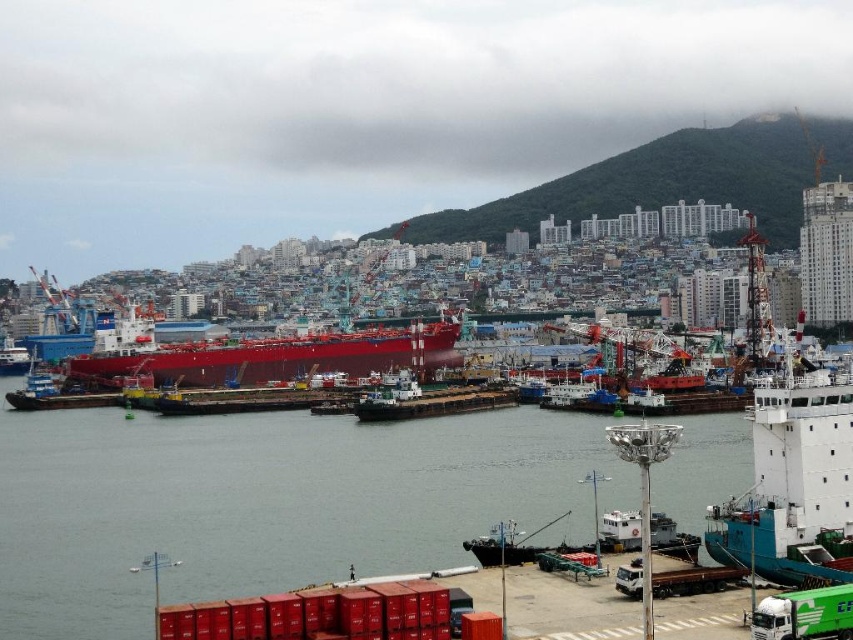
Question: Can you confirm if transparent water at center is thinner than white matte ship at right?

Choices:
 (A) yes
 (B) no

Answer: (B)

Question: Is transparent water at center above glossy red ship at center?

Choices:
 (A) yes
 (B) no

Answer: (B)

Question: Which object is farther from the camera taking this photo?

Choices:
 (A) glossy red ship at center
 (B) transparent water at center

Answer: (A)

Question: Estimate the real-world distances between objects in this image. Which object is closer to the glossy red ship at center?

Choices:
 (A) white matte ship at right
 (B) transparent water at center

Answer: (B)

Question: Is transparent water at center positioned before white matte ship at right?

Choices:
 (A) yes
 (B) no

Answer: (B)

Question: Which object is positioned farthest from the transparent water at center?

Choices:
 (A) glossy red ship at center
 (B) white matte ship at right

Answer: (A)